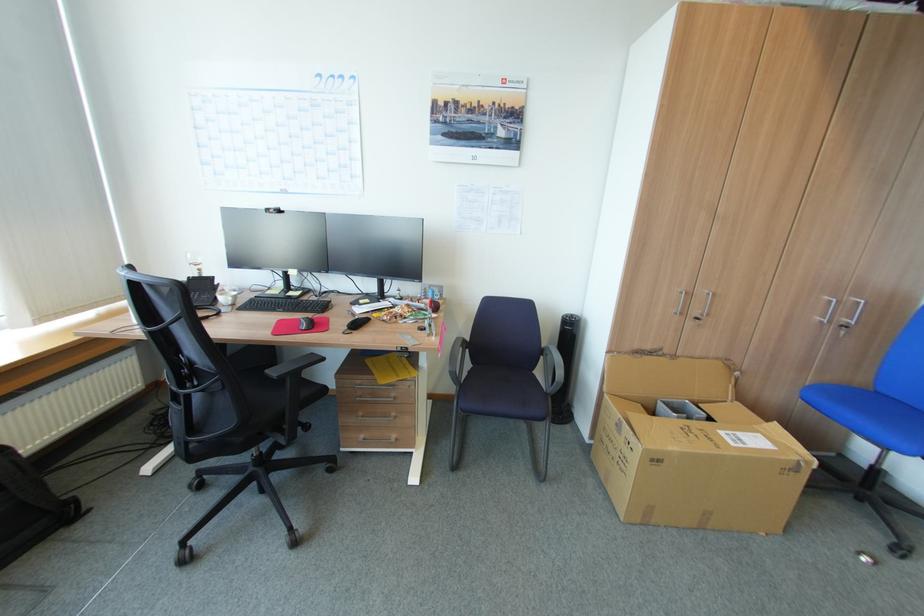
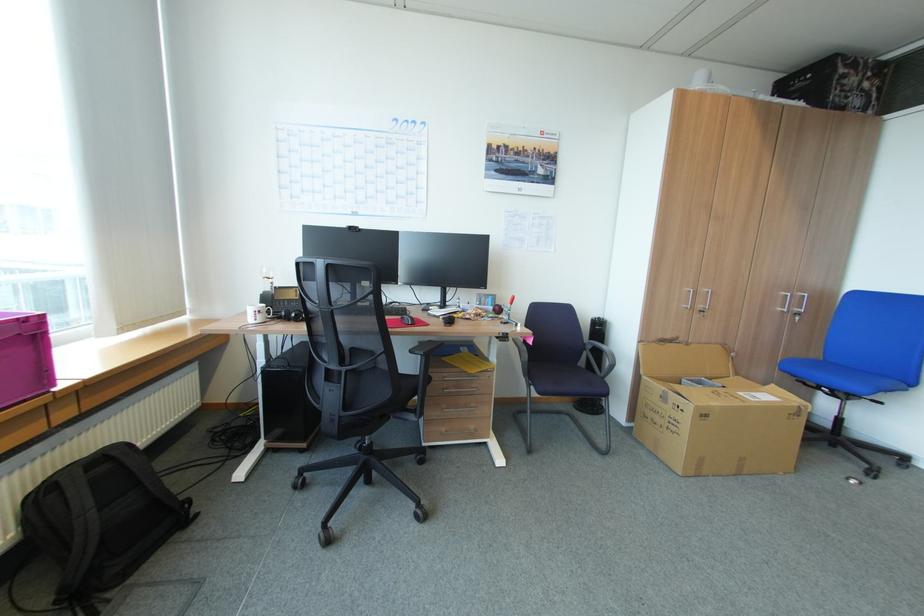
Find the pixel in the second image that matches [548,346] in the first image.

(590, 342)